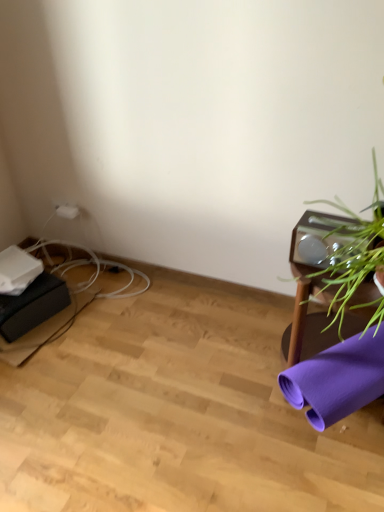
I want to click on green leafy plant at right, so click(x=335, y=275).

The width and height of the screenshot is (384, 512). Describe the element at coordinates (67, 211) in the screenshot. I see `white plastic plug at upper left` at that location.

Find the location of a particular element. green leafy plant at right is located at coordinates (335, 275).

Is point (316, 327) less distant than point (59, 212)?

Yes, it is in front of point (59, 212).

Which of these two, green leafy plant at right or white plastic plug at upper left, is smaller?

white plastic plug at upper left is smaller.

Can you confirm if green leafy plant at right is positioned to the left of white plastic plug at upper left?

No, green leafy plant at right is not to the left of white plastic plug at upper left.

Is white plastic plug at upper left located outside purple fabric yoga mat at lower right?

Yes, white plastic plug at upper left is outside of purple fabric yoga mat at lower right.

Is white plastic plug at upper left at the right side of purple fabric yoga mat at lower right?

Incorrect, white plastic plug at upper left is not on the right side of purple fabric yoga mat at lower right.

Which object is closer to the camera, white plastic plug at upper left or purple fabric yoga mat at lower right?

Positioned in front is purple fabric yoga mat at lower right.

From a real-world perspective, is white plastic plug at upper left physically located above or below purple fabric yoga mat at lower right?

In terms of real-world spatial position, white plastic plug at upper left is above purple fabric yoga mat at lower right.

There is a purple fabric yoga mat at lower right. At what (x,y) coordinates should I click in order to perform the action: click on houseplant above it (from a real-world perspective). Please return your answer as a coordinate pair (x, y). Looking at the image, I should click on (335, 275).

Is purple fabric yoga mat at lower right not inside green leafy plant at right?

Yes.

Considering the sizes of objects purple fabric yoga mat at lower right and green leafy plant at right in the image provided, who is taller, purple fabric yoga mat at lower right or green leafy plant at right?

green leafy plant at right is taller.

From a real-world perspective, is purple fabric yoga mat at lower right below green leafy plant at right?

Correct, in the physical world, purple fabric yoga mat at lower right is lower than green leafy plant at right.

Looking at this image, between white plastic plug at upper left and green leafy plant at right, which one has smaller width?

white plastic plug at upper left is thinner.

Based on the photo, considering the positions of objects white plastic plug at upper left and green leafy plant at right in the image provided, who is more to the left, white plastic plug at upper left or green leafy plant at right?

white plastic plug at upper left.

Does point (74, 218) come behind point (335, 262)?

Yes, it is.

From the image's perspective, which object appears higher, green leafy plant at right or purple fabric yoga mat at lower right?

green leafy plant at right appears higher in the image.

Does green leafy plant at right have a greater height compared to purple fabric yoga mat at lower right?

Yes, green leafy plant at right is taller than purple fabric yoga mat at lower right.

Can you confirm if green leafy plant at right is positioned to the left of purple fabric yoga mat at lower right?

Correct, you'll find green leafy plant at right to the left of purple fabric yoga mat at lower right.

Is purple fabric yoga mat at lower right inside green leafy plant at right?

That's incorrect, purple fabric yoga mat at lower right is not inside green leafy plant at right.

From a real-world perspective, does purple fabric yoga mat at lower right stand above white plastic plug at upper left?

No.

Does purple fabric yoga mat at lower right have a greater width compared to white plastic plug at upper left?

Correct, the width of purple fabric yoga mat at lower right exceeds that of white plastic plug at upper left.

How different are the orientations of purple fabric yoga mat at lower right and white plastic plug at upper left in degrees?

The angular difference between purple fabric yoga mat at lower right and white plastic plug at upper left is 37.2 degrees.

From the image's perspective, is purple fabric yoga mat at lower right on top of white plastic plug at upper left?

Incorrect, from the image's perspective, purple fabric yoga mat at lower right is lower than white plastic plug at upper left.

The width and height of the screenshot is (384, 512). I want to click on plug above the green leafy plant at right (from the image's perspective), so click(67, 211).

At what (x,y) coordinates should I click in order to perform the action: click on beach towel on the right of white plastic plug at upper left. Please return your answer as a coordinate pair (x, y). The image size is (384, 512). Looking at the image, I should click on (337, 379).

Estimate the real-world distances between objects in this image. Which object is further from white plastic plug at upper left, green leafy plant at right or purple fabric yoga mat at lower right?

Among the two, purple fabric yoga mat at lower right is located further to white plastic plug at upper left.

Considering their positions, is green leafy plant at right positioned closer to purple fabric yoga mat at lower right than white plastic plug at upper left?

green leafy plant at right is closer to purple fabric yoga mat at lower right.

Based on the photo, estimate the real-world distances between objects in this image. Which object is closer to white plastic plug at upper left, purple fabric yoga mat at lower right or green leafy plant at right?

green leafy plant at right lies closer to white plastic plug at upper left than the other object.

Estimate the real-world distances between objects in this image. Which object is further from green leafy plant at right, white plastic plug at upper left or purple fabric yoga mat at lower right?

Based on the image, white plastic plug at upper left appears to be further to green leafy plant at right.

Looking at the image, which one is located further to green leafy plant at right, purple fabric yoga mat at lower right or white plastic plug at upper left?

Based on the image, white plastic plug at upper left appears to be further to green leafy plant at right.

Consider the image. Based on their spatial positions, is white plastic plug at upper left or green leafy plant at right closer to purple fabric yoga mat at lower right?

The object closer to purple fabric yoga mat at lower right is green leafy plant at right.

The image size is (384, 512). Find the location of `beach towel between green leafy plant at right and white plastic plug at upper left along the z-axis`. beach towel between green leafy plant at right and white plastic plug at upper left along the z-axis is located at coordinates (337, 379).